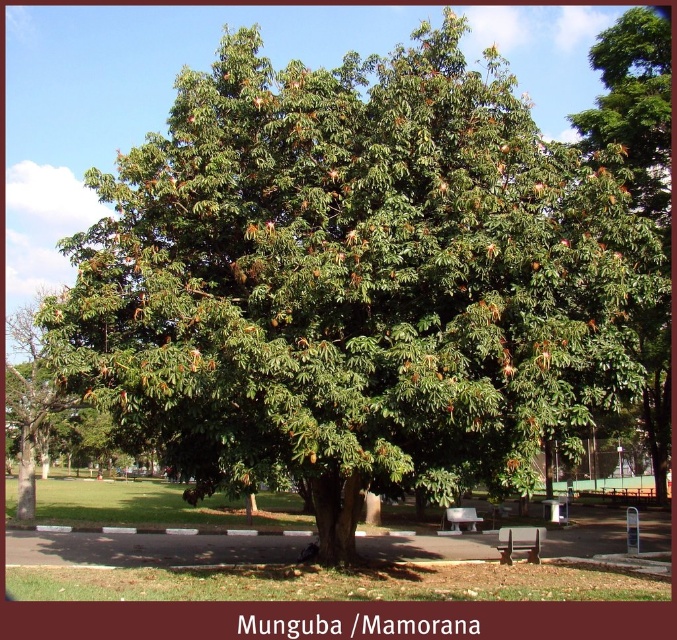
From the picture: Is green leafy tree at center thinner than wooden bench at lower right?

No.

Between point (655, 339) and point (561, 500), which one is positioned in front?

Point (655, 339) is in front.

I want to click on green leafy tree at center, so click(634, 108).

Between point (517, 547) and point (468, 525), which one is positioned in front?

Point (517, 547) is in front.

Does brown wooden bench at lower center come behind white plastic bench at center?

No, brown wooden bench at lower center is in front of white plastic bench at center.

Measure the distance between point (521, 529) and camera.

The distance of point (521, 529) from camera is 14.90 meters.

The width and height of the screenshot is (677, 640). In order to click on brown wooden bench at lower center in this screenshot , I will do `click(519, 544)`.

Who is shorter, green leafy tree at center or white plastic bench at center?

Standing shorter between the two is white plastic bench at center.

Does green leafy tree at center have a greater width compared to white plastic bench at center?

Yes, green leafy tree at center is wider than white plastic bench at center.

Is point (609, 118) positioned behind point (462, 512)?

No.

You are a GUI agent. You are given a task and a screenshot of the screen. Output one action in this format:
    pyautogui.click(x=<x>, y=<y>)
    Task: Click on the green leafy tree at center
    
    Given the screenshot: What is the action you would take?
    pyautogui.click(x=634, y=108)